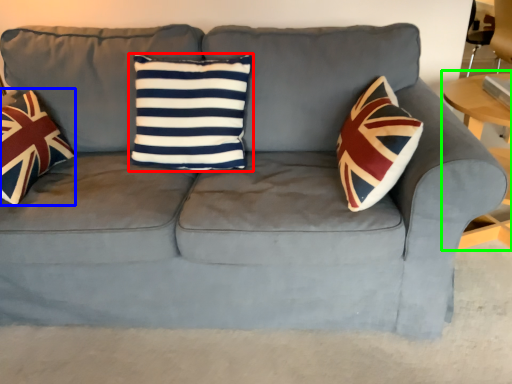
Question: Which is nearer to the pillow (highlighted by a red box)? throw pillow (highlighted by a blue box) or table (highlighted by a green box).

Choices:
 (A) throw pillow
 (B) table

Answer: (A)